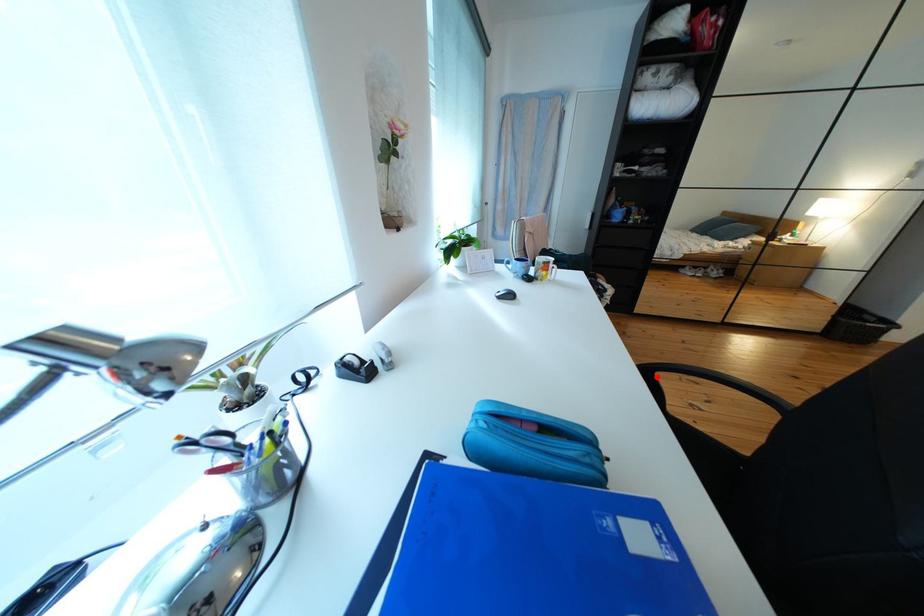
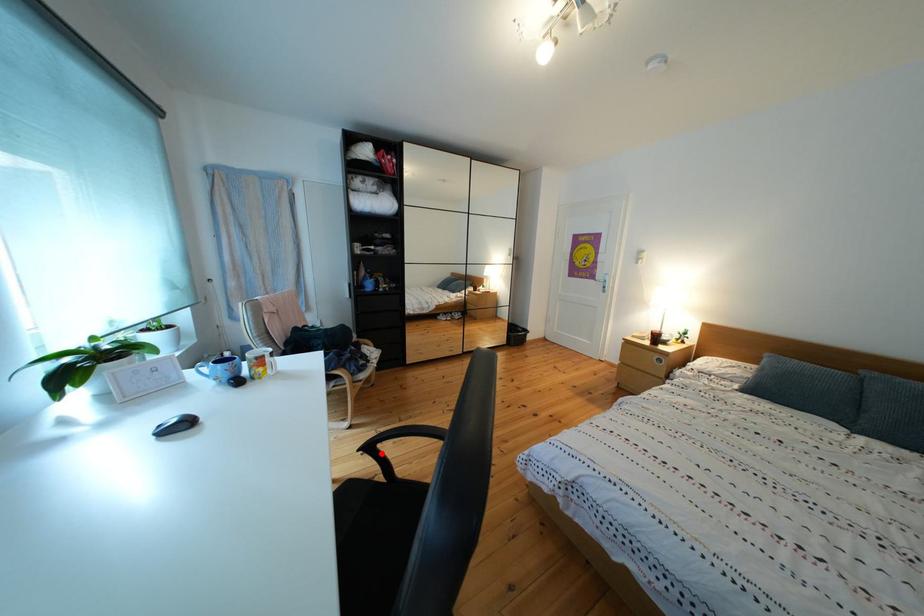
I am providing you with two images of the same scene from different viewpoints. A red point is marked on the first image and another point is marked on the second image. Do the highlighted points in image1 and image2 indicate the same real-world spot?

Yes